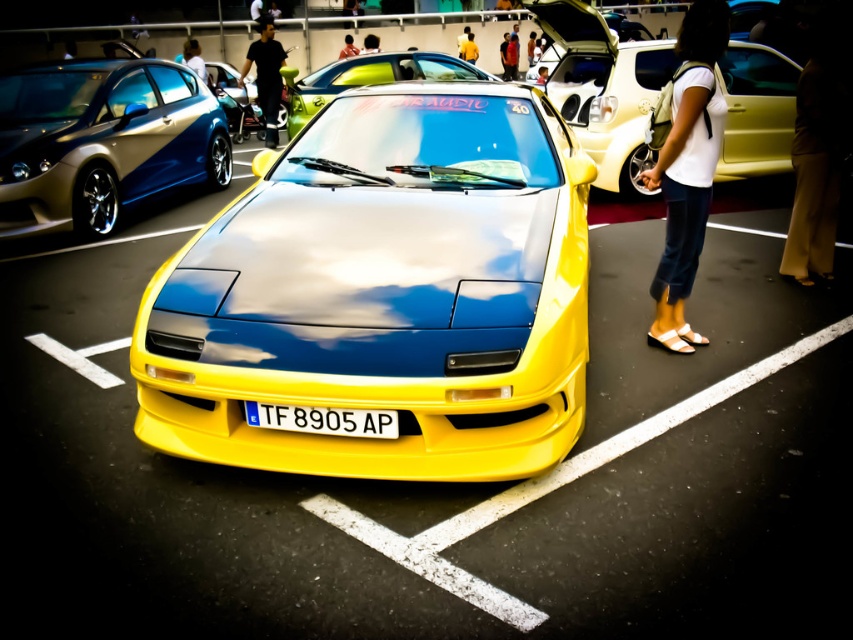
Who is more distant from viewer, (267, 96) or (373, 49)?

Positioned behind is point (373, 49).

Measure the distance between black smooth shirt at upper center and camera.

10.28 meters

Who is more distant from viewer, (264, 113) or (364, 45)?

Positioned behind is point (364, 45).

Locate an element on the screen. black smooth shirt at upper center is located at coordinates pyautogui.click(x=265, y=76).

Who is positioned more to the left, metallic gold hatchback at left or shiny metallic car at center?

metallic gold hatchback at left is more to the left.

Is metallic gold hatchback at left to the right of shiny metallic car at center from the viewer's perspective?

In fact, metallic gold hatchback at left is to the left of shiny metallic car at center.

Does point (219, 138) come farther from viewer compared to point (363, 84)?

Yes.

Identify the location of metallic gold hatchback at left. The image size is (853, 640). (102, 141).

Which is below, yellow glossy sports car at center or yellow matte license plate at center?

yellow matte license plate at center is below.

Does yellow glossy sports car at center lie behind yellow matte license plate at center?

No, yellow glossy sports car at center is in front of yellow matte license plate at center.

Is point (508, 346) farther from viewer compared to point (245, 404)?

No.

I want to click on yellow glossy sports car at center, so click(x=383, y=294).